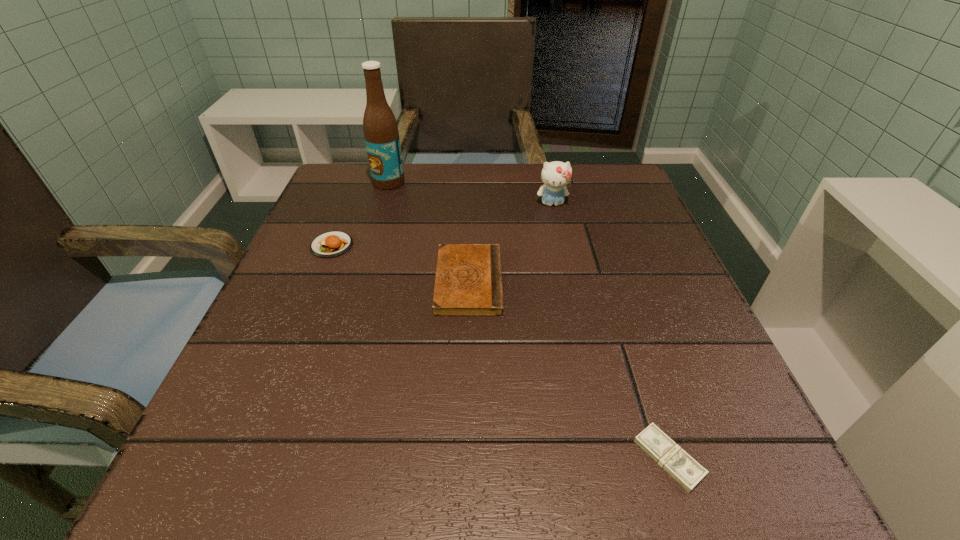
Identify the location of free region that satisfies the following two spatial constraints: 1. on the front side of the nearest object; 2. on the left side of the patty (food). (246, 458).

Where is `vacant area that satisfies the following two spatial constraints: 1. on the spine side of the third object from left to right; 2. on the left side of the money`? Image resolution: width=960 pixels, height=540 pixels. vacant area that satisfies the following two spatial constraints: 1. on the spine side of the third object from left to right; 2. on the left side of the money is located at coordinates [464, 458].

The height and width of the screenshot is (540, 960). I want to click on blank space that satisfies the following two spatial constraints: 1. on the spine side of the diary; 2. on the right side of the nearest object, so click(464, 458).

The width and height of the screenshot is (960, 540). Identify the location of vacant position in the image that satisfies the following two spatial constraints: 1. on the spine side of the shortest object; 2. on the right side of the diary. (464, 458).

Find the location of `free spot that satisfies the following two spatial constraints: 1. on the spine side of the shortest object; 2. on the right side of the diary`. free spot that satisfies the following two spatial constraints: 1. on the spine side of the shortest object; 2. on the right side of the diary is located at coordinates (464, 458).

The width and height of the screenshot is (960, 540). In order to click on free region that satisfies the following two spatial constraints: 1. on the front-facing side of the nearest object; 2. on the right side of the fourth nearest object in this screenshot , I will do `click(609, 458)`.